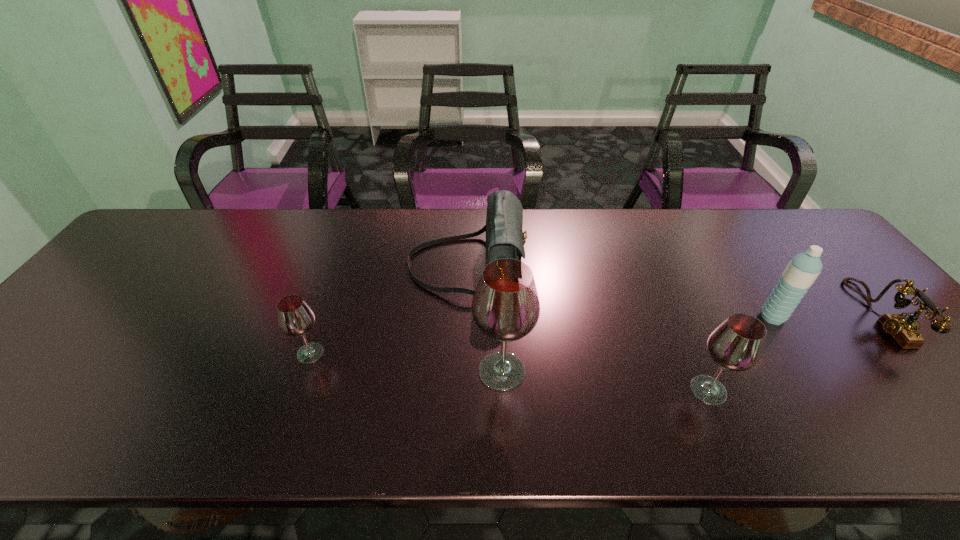
Please point a vacant point for placing a wineglass on the left. Please provide its 2D coordinates. Your answer should be formatted as a tuple, i.e. [(x, y)], where the tuple contains the x and y coordinates of a point satisfying the conditions above.

[(132, 337)]